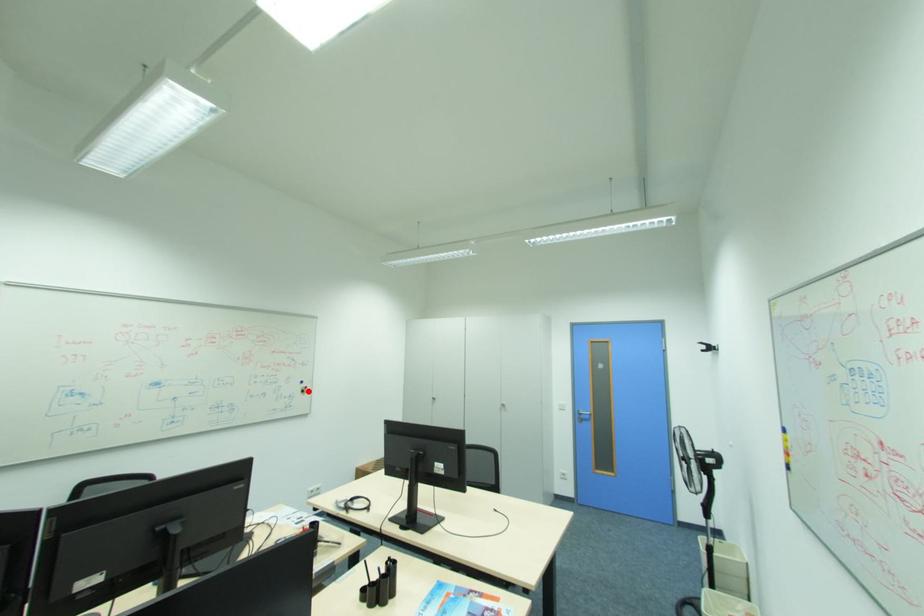
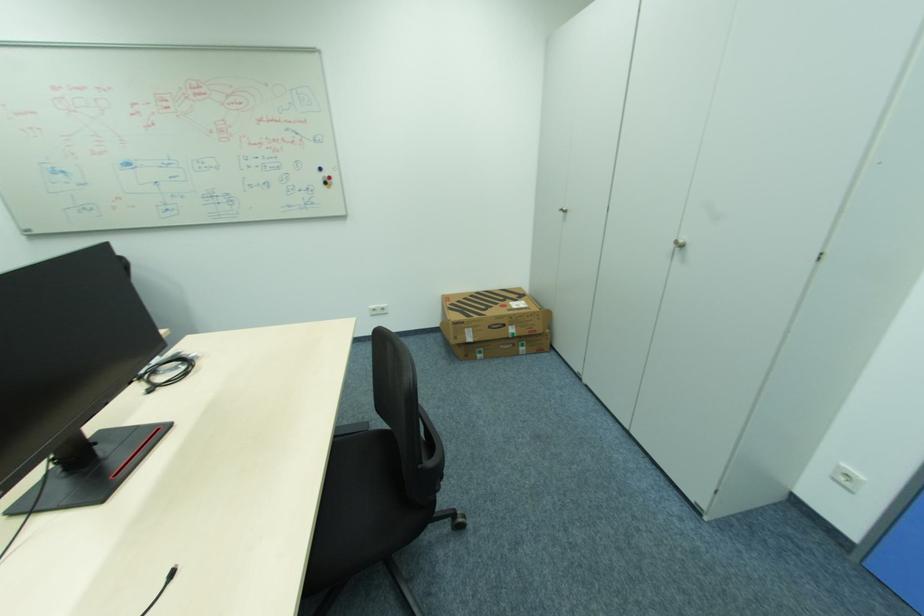
Question: I am providing you with two images of the same scene from different viewpoints. In image1, a red point is highlighted. Considering the same 3D point in image2, which of the following is correct?

Choices:
 (A) It is closer
 (B) It is farther

Answer: (A)